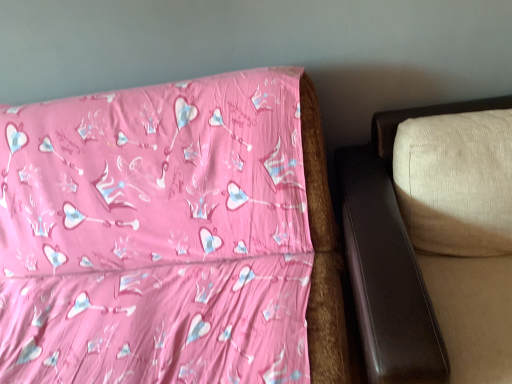
Image resolution: width=512 pixels, height=384 pixels. I want to click on pink fabric bed at upper left, so click(170, 237).

What do you see at coordinates (170, 237) in the screenshot?
I see `pink fabric bed at upper left` at bounding box center [170, 237].

This screenshot has width=512, height=384. Identify the location of pink fabric bed at upper left. (170, 237).